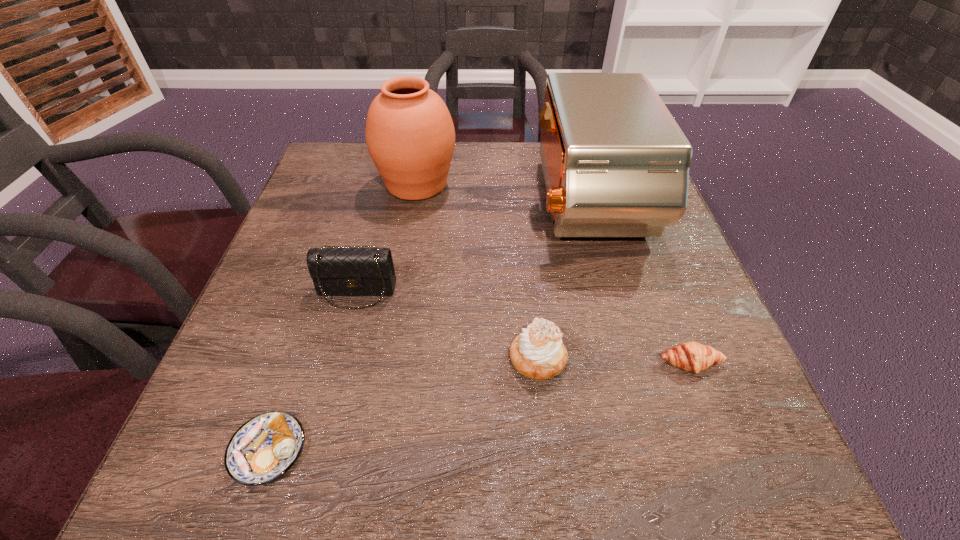
Select which pastry appears as the third closest to the clutch bag. Please provide its 2D coordinates. Your answer should be formatted as a tuple, i.e. [(x, y)], where the tuple contains the x and y coordinates of a point satisfying the conditions above.

[(691, 356)]

Locate which pastry is the second closest to the third farthest object. Please provide its 2D coordinates. Your answer should be formatted as a tuple, i.e. [(x, y)], where the tuple contains the x and y coordinates of a point satisfying the conditions above.

[(538, 353)]

Where is `vacant point that satisfies the following two spatial constraints: 1. on the front flap of the second pastry from right to left; 2. on the right side of the third farthest object`? The image size is (960, 540). vacant point that satisfies the following two spatial constraints: 1. on the front flap of the second pastry from right to left; 2. on the right side of the third farthest object is located at coordinates (339, 359).

Where is `vacant space that satisfies the following two spatial constraints: 1. on the door side of the toaster oven; 2. on the front flap of the clutch bag`? This screenshot has width=960, height=540. vacant space that satisfies the following two spatial constraints: 1. on the door side of the toaster oven; 2. on the front flap of the clutch bag is located at coordinates (611, 292).

You are a GUI agent. You are given a task and a screenshot of the screen. Output one action in this format:
    pyautogui.click(x=<x>, y=<y>)
    Task: Click on the vacant position in the image that satisfies the following two spatial constraints: 1. on the door side of the toaster oven; 2. on the front flap of the fourth nearest object
    Image resolution: width=960 pixels, height=540 pixels.
    Given the screenshot: What is the action you would take?
    [611, 292]